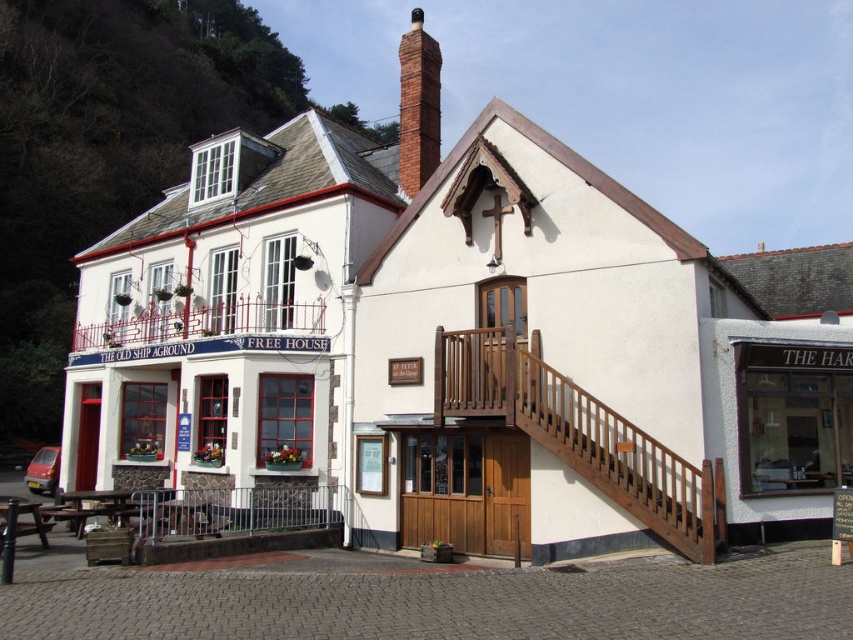
Question: Which object is the farthest from the wooden stairs at center?

Choices:
 (A) white painted wood pub at left
 (B) red brick chimney at upper center

Answer: (B)

Question: Which point appears farthest from the camera in this image?

Choices:
 (A) (189, 342)
 (B) (431, 68)

Answer: (B)

Question: Among these objects, which one is nearest to the camera?

Choices:
 (A) wooden stairs at center
 (B) white painted wood pub at left

Answer: (A)

Question: Does white painted wood pub at left appear under red brick chimney at upper center?

Choices:
 (A) yes
 (B) no

Answer: (A)

Question: Is wooden stairs at center thinner than red brick chimney at upper center?

Choices:
 (A) no
 (B) yes

Answer: (B)

Question: Can you confirm if white painted wood pub at left is positioned to the left of wooden stairs at center?

Choices:
 (A) no
 (B) yes

Answer: (B)